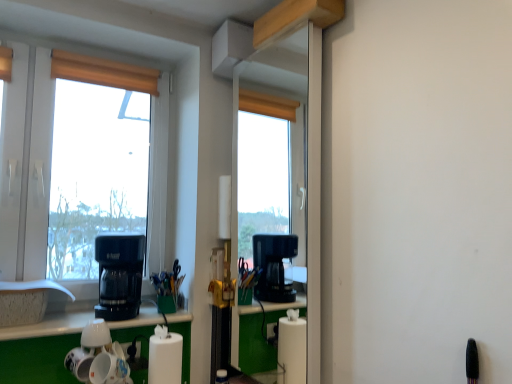
You are a GUI agent. You are given a task and a screenshot of the screen. Output one action in this format:
    pyautogui.click(x=<x>, y=<y>)
    Task: Click on the vacant point above wooden blind at upper left (from a real-world perspective)
    
    Given the screenshot: What is the action you would take?
    pyautogui.click(x=109, y=58)